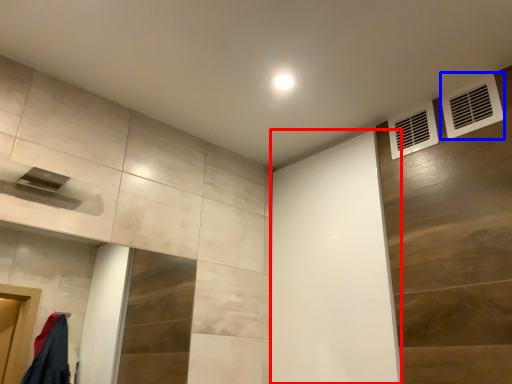
Question: Which point is further to the camera, screen door (highlighted by a red box) or air conditioning (highlighted by a blue box)?

Choices:
 (A) screen door
 (B) air conditioning

Answer: (A)